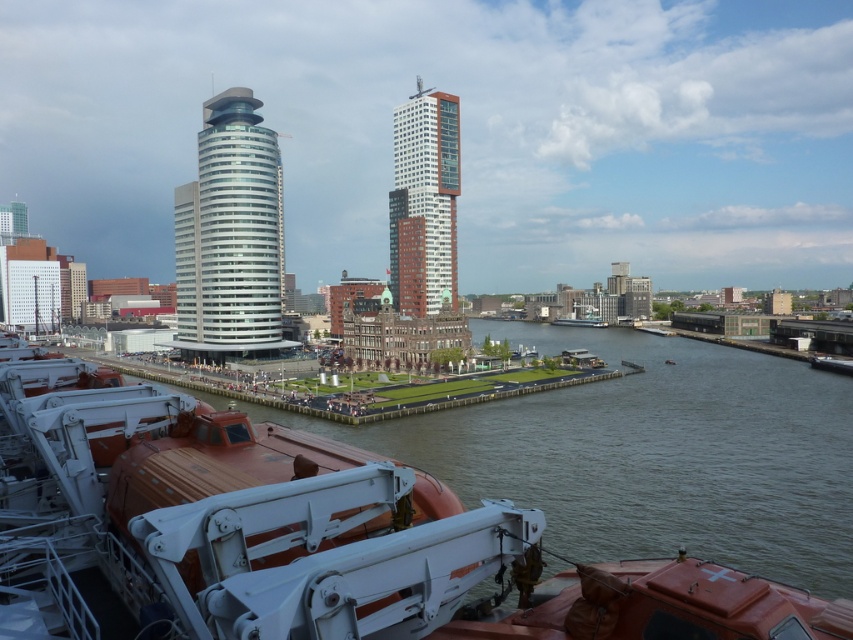
Question: Which point is farther from the camera taking this photo?

Choices:
 (A) (393, 212)
 (B) (218, 320)

Answer: (A)

Question: Is orange rubber lifeboat at lower left thinner than red brick building at center?

Choices:
 (A) no
 (B) yes

Answer: (A)

Question: Based on their relative distances, which object is farther from the red brick building at center?

Choices:
 (A) orange rubber lifeboat at lower left
 (B) white glass tower at center

Answer: (A)

Question: Is orange rubber lifeboat at lower left wider than white glass tower at center?

Choices:
 (A) yes
 (B) no

Answer: (B)

Question: Which of these objects is positioned closest to the orange rubber lifeboat at lower left?

Choices:
 (A) red brick building at center
 (B) white glass tower at center

Answer: (B)

Question: Where is orange rubber lifeboat at lower left located in relation to red brick building at center in the image?

Choices:
 (A) left
 (B) right

Answer: (A)